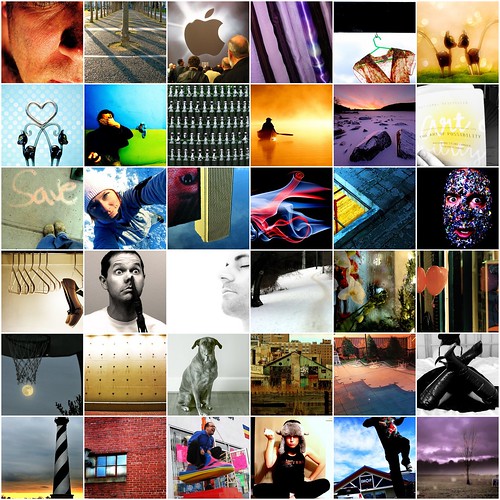
The image size is (500, 500). What are the coordinates of `pictures in 5th row from top` in the screenshot? It's located at (53, 380), (127, 372), (209, 374), (306, 368), (376, 372), (465, 373).